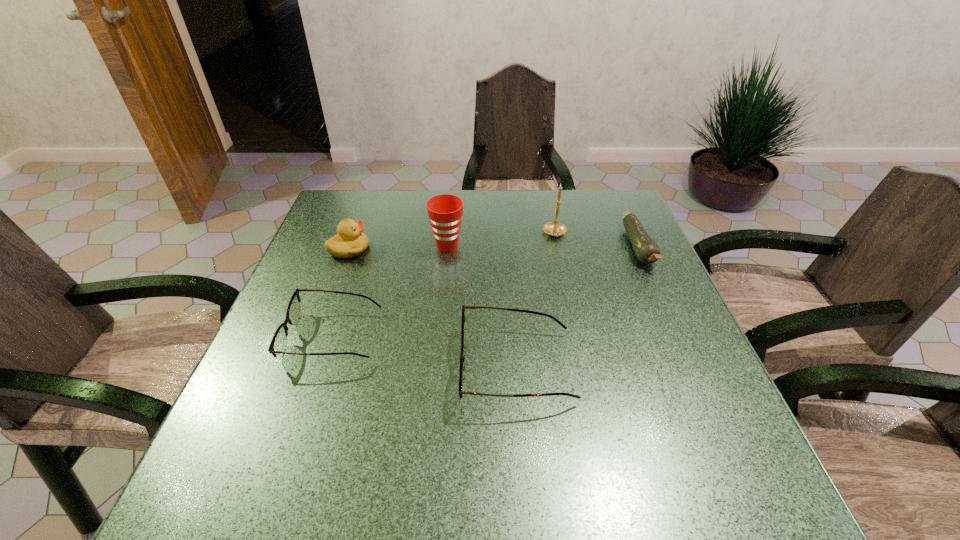
Locate an element on the screen. This screenshot has width=960, height=540. duckling that is at the left edge is located at coordinates (349, 242).

This screenshot has width=960, height=540. Find the location of `object at the right edge`. object at the right edge is located at coordinates (647, 251).

The width and height of the screenshot is (960, 540). In order to click on object that is at the far right corner in this screenshot , I will do `click(647, 251)`.

You are a GUI agent. You are given a task and a screenshot of the screen. Output one action in this format:
    pyautogui.click(x=<x>, y=<y>)
    Task: Click on the free space at the far edge of the desktop
    The image size is (960, 540).
    Given the screenshot: What is the action you would take?
    pyautogui.click(x=391, y=190)

Where is `free space at the near edge of the desktop`? free space at the near edge of the desktop is located at coordinates (350, 421).

Locate an element on the screen. vacant space at the left edge of the desktop is located at coordinates (305, 377).

Where is `vacant space at the right edge`? The height and width of the screenshot is (540, 960). vacant space at the right edge is located at coordinates (598, 255).

In the image, there is a desktop. Where is `vacant space at the far left corner`? Image resolution: width=960 pixels, height=540 pixels. vacant space at the far left corner is located at coordinates (349, 193).

Identify the location of free space at the far right corner of the desktop. (607, 202).

Where is `free point at the near right corner`? Image resolution: width=960 pixels, height=540 pixels. free point at the near right corner is located at coordinates (708, 417).